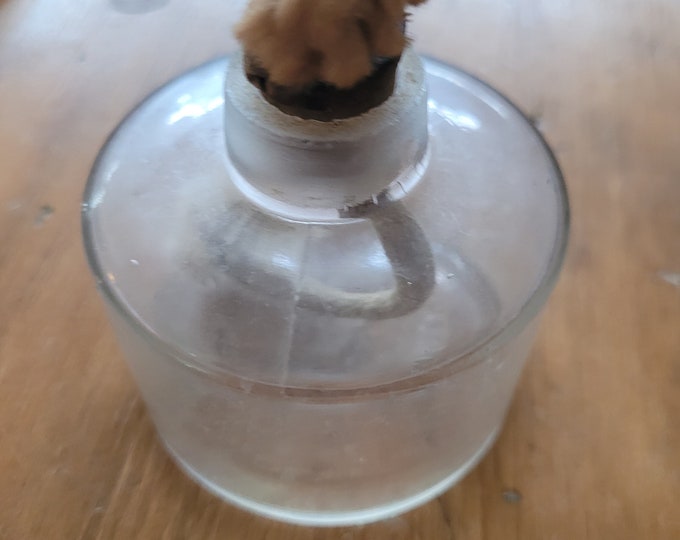
Where is `table`? The width and height of the screenshot is (680, 540). table is located at coordinates (77, 478), (67, 291), (73, 98), (530, 85), (619, 256), (556, 461).